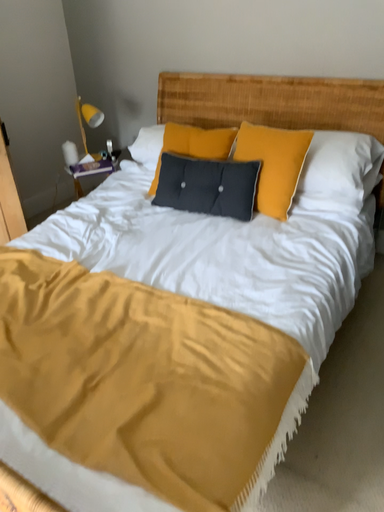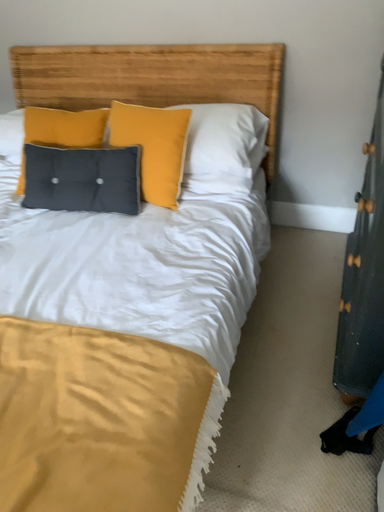
Question: Which way did the camera rotate in the video?

Choices:
 (A) rotated left
 (B) rotated right

Answer: (B)